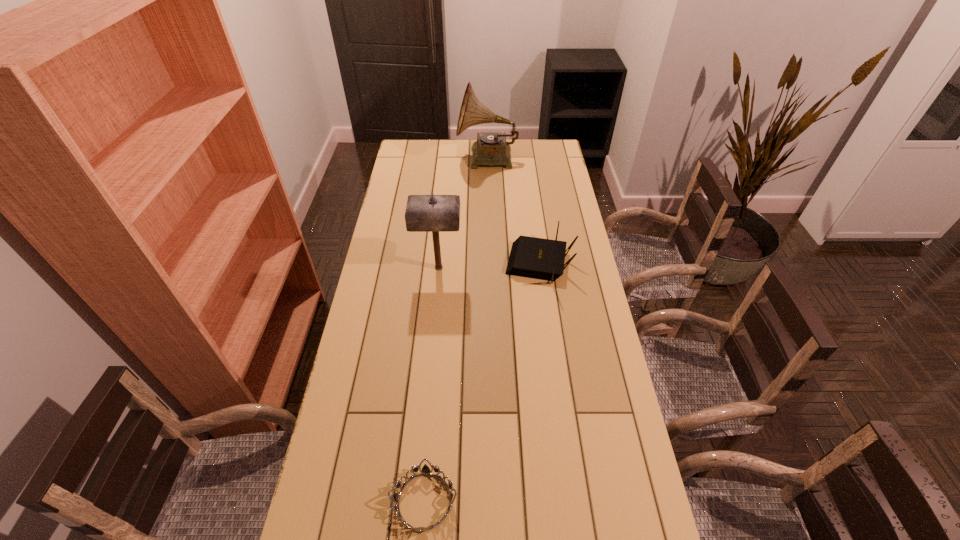
Identify which object is the third closest to the mallet. Please provide its 2D coordinates. Your answer should be formatted as a tuple, i.e. [(x, y)], where the tuple contains the x and y coordinates of a point satisfying the conditions above.

[(425, 470)]

Identify the location of free space that satisfies the following two spatial constraints: 1. on the back side of the mallet; 2. on the left side of the router. (439, 265).

I want to click on vacant space that satisfies the following two spatial constraints: 1. from the horn of the farthest object; 2. on the left side of the third tallest object, so click(x=490, y=265).

Locate an element on the screen. The height and width of the screenshot is (540, 960). free location that satisfies the following two spatial constraints: 1. from the horn of the router; 2. on the right side of the farthest object is located at coordinates (490, 265).

Find the location of a particular element. This screenshot has width=960, height=540. blank space that satisfies the following two spatial constraints: 1. from the horn of the third tallest object; 2. on the right side of the record player is located at coordinates (490, 265).

The image size is (960, 540). Find the location of `free region that satisfies the following two spatial constraints: 1. from the horn of the record player; 2. on the front side of the mallet`. free region that satisfies the following two spatial constraints: 1. from the horn of the record player; 2. on the front side of the mallet is located at coordinates (490, 267).

Image resolution: width=960 pixels, height=540 pixels. Identify the location of free space that satisfies the following two spatial constraints: 1. from the horn of the record player; 2. on the back side of the third tallest object. (490, 265).